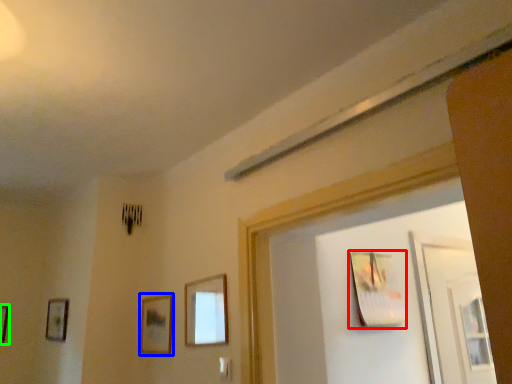
Question: Based on their relative distances, which object is farther from picture frame (highlighted by a red box)? Choose from picture frame (highlighted by a blue box) and picture frame (highlighted by a green box).

Choices:
 (A) picture frame
 (B) picture frame

Answer: (B)